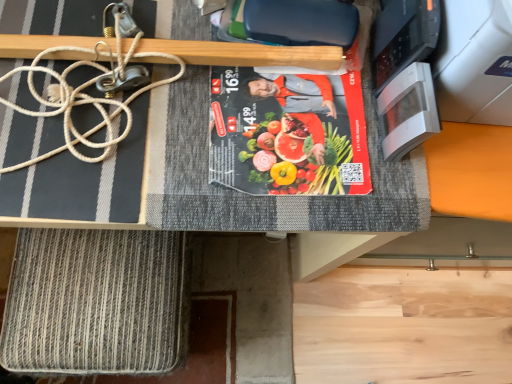
Question: From a real-world perspective, does wooden at upper center sit lower than rope-like textured mat at lower left?

Choices:
 (A) no
 (B) yes

Answer: (A)

Question: Considering the relative sizes of wooden at upper center and rope-like textured mat at lower left in the image provided, is wooden at upper center smaller than rope-like textured mat at lower left?

Choices:
 (A) no
 (B) yes

Answer: (B)

Question: Can you confirm if wooden at upper center is thinner than rope-like textured mat at lower left?

Choices:
 (A) yes
 (B) no

Answer: (A)

Question: Considering the relative positions of wooden at upper center and rope-like textured mat at lower left in the image provided, is wooden at upper center in front of rope-like textured mat at lower left?

Choices:
 (A) no
 (B) yes

Answer: (B)

Question: Considering the relative sizes of wooden at upper center and rope-like textured mat at lower left in the image provided, is wooden at upper center bigger than rope-like textured mat at lower left?

Choices:
 (A) no
 (B) yes

Answer: (A)

Question: Is wooden at upper center turned away from rope-like textured mat at lower left?

Choices:
 (A) no
 (B) yes

Answer: (A)

Question: From the image's perspective, is white glossy microwave at upper right under white rope at upper left?

Choices:
 (A) no
 (B) yes

Answer: (B)

Question: Is white glossy microwave at upper right far from white rope at upper left?

Choices:
 (A) no
 (B) yes

Answer: (A)

Question: Can you confirm if white glossy microwave at upper right is smaller than white rope at upper left?

Choices:
 (A) no
 (B) yes

Answer: (B)

Question: Is white glossy microwave at upper right to the left of white rope at upper left from the viewer's perspective?

Choices:
 (A) no
 (B) yes

Answer: (A)

Question: Is white glossy microwave at upper right oriented away from white rope at upper left?

Choices:
 (A) no
 (B) yes

Answer: (A)

Question: Does white glossy microwave at upper right lie behind white rope at upper left?

Choices:
 (A) no
 (B) yes

Answer: (A)

Question: Is rope-like textured mat at lower left wider than wooden at upper center?

Choices:
 (A) no
 (B) yes

Answer: (B)